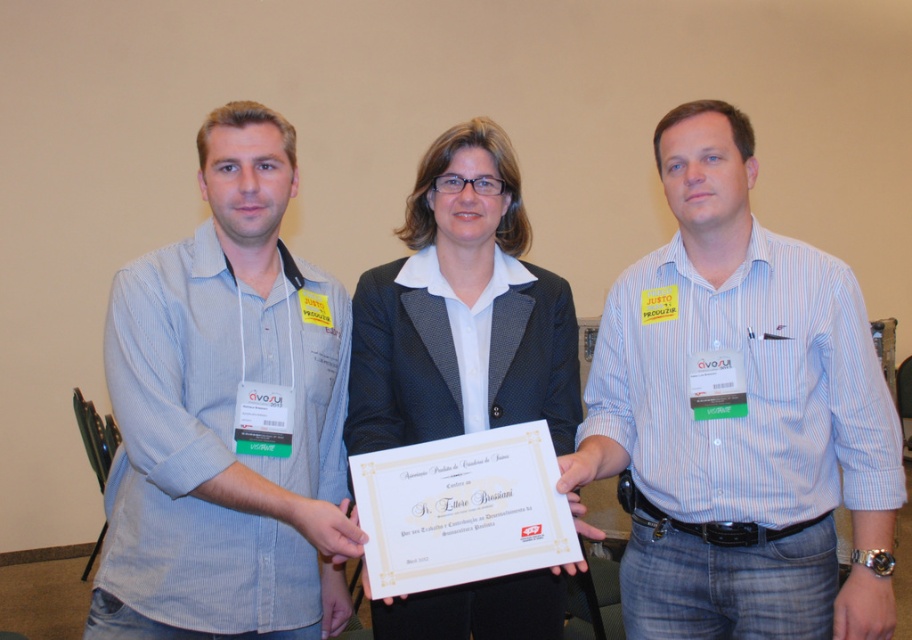
Looking at this image, you are standing in a room and see a blue striped shirt at center. You want to hand them a document without moving closer than 1.2 meters for privacy. Is the current distance sufficient?

The blue striped shirt at center and viewer are 1.35 meters apart from each other, which is more than the required 1.2 meters, so the current distance is sufficient to hand the document without moving closer.